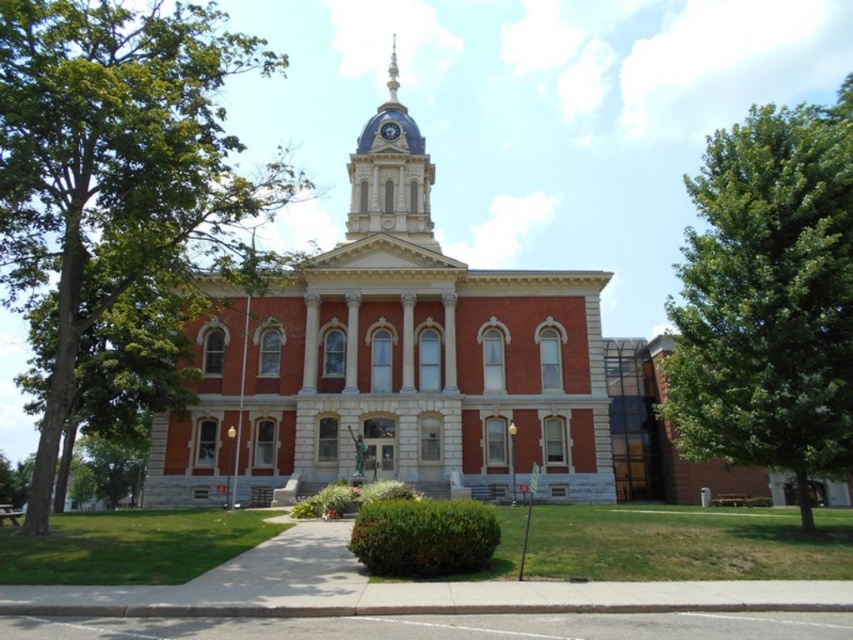
You are an architect designing a new garden layout for the courthouse. You have a green leafy tree at left and a shiny silver spire at upper center in your design. Which object should you place closer to the entrance to ensure the spire remains visible from the front? Please explain your reasoning based on their sizes.

The green leafy tree at left is larger in size than the shiny silver spire at upper center. To ensure the spire remains visible from the front, the tree should be placed farther away from the entrance so that the smaller spire at upper center isn not obstructed by the larger tree.

You are an architect assessing the building for a new project. You notice the green leafy tree at left and the blue domed clock tower at upper center. Which structure is taller?

The green leafy tree at left is taller than the blue domed clock tower at upper center according to the description.